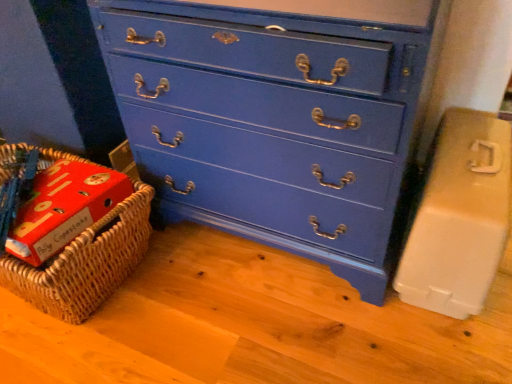
Question: Based on their sizes in the image, would you say woven brown basket at lower left is bigger or smaller than beige plastic container at right?

Choices:
 (A) small
 (B) big

Answer: (B)

Question: From the image's perspective, is woven brown basket at lower left above or below beige plastic container at right?

Choices:
 (A) above
 (B) below

Answer: (B)

Question: Which object is the closest to the beige plastic container at right?

Choices:
 (A) blue painted wood chest of drawers at center
 (B) woven brown basket at lower left

Answer: (A)

Question: Estimate the real-world distances between objects in this image. Which object is closer to the beige plastic container at right?

Choices:
 (A) woven brown basket at lower left
 (B) blue painted wood chest of drawers at center

Answer: (B)